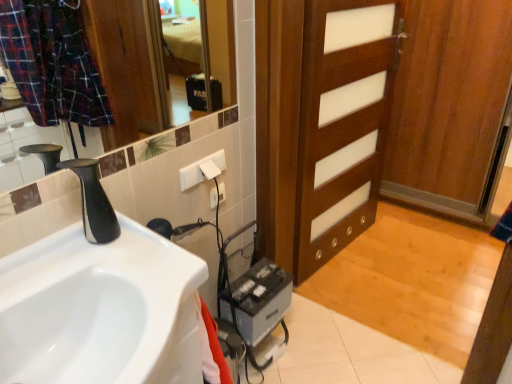
You are a GUI agent. You are given a task and a screenshot of the screen. Output one action in this format:
    pyautogui.click(x=<x>, y=<y>)
    Task: Click on the vacant region to the right of black matte faucet at left
    Image resolution: width=512 pixels, height=384 pixels.
    Given the screenshot: What is the action you would take?
    pyautogui.click(x=155, y=260)